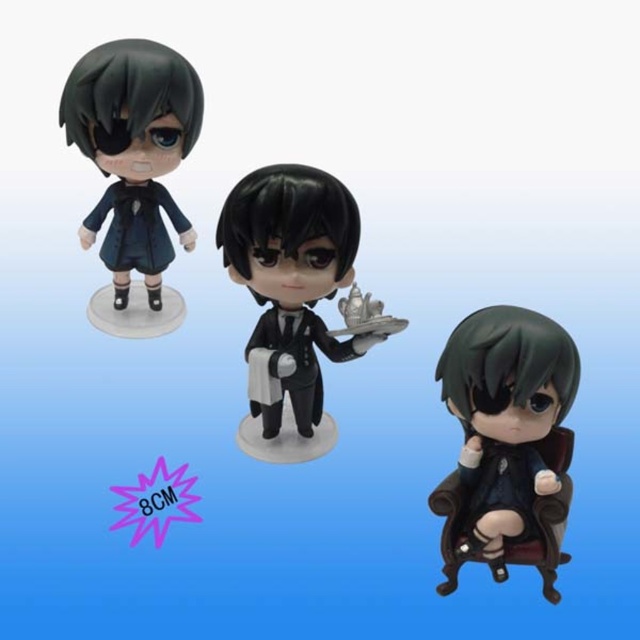
You are an interior designer arranging these two items on a shelf. The shelf has a width of 16 inches. Can both the matte black suit at center and the matte black coat at upper left be placed side by side without overlapping?

The matte black suit at center is 15.12 inches from the matte black coat at upper left, so yes, both can be placed side by side on the 16 inch shelf without overlapping since the total distance between them is less than the shelf width.

You are an art collector who wants to display the satin black figurine at center and the matte black doll at upper left on a shelf. Which one should you place first to ensure they both fit on the shelf?

The satin black figurine at center has a smaller width than the matte black doll at upper left, so you should place the matte black doll at upper left first to ensure both fit on the shelf.